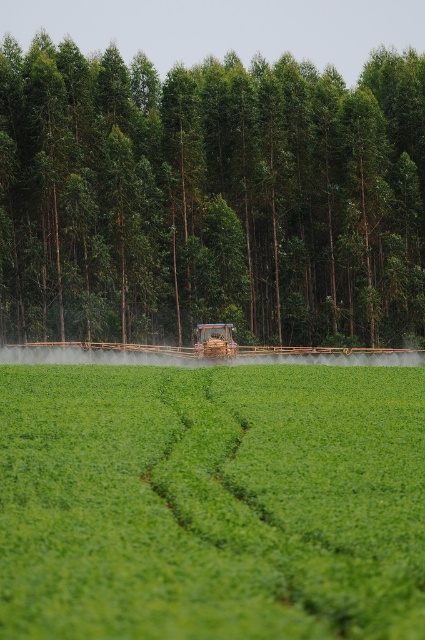
Who is shorter, green leafy tree at center or wooden brown tractor at center?

wooden brown tractor at center is shorter.

Can you confirm if green leafy tree at center is smaller than wooden brown tractor at center?

Incorrect, green leafy tree at center is not smaller in size than wooden brown tractor at center.

Who is more forward, (119, 134) or (198, 339)?

Point (198, 339) is in front.

Where is `green leafy tree at center`? The image size is (425, 640). green leafy tree at center is located at coordinates (209, 198).

Can you confirm if green leafy tree at center is positioned above green leafy field at center?

Yes, green leafy tree at center is above green leafy field at center.

How much distance is there between green leafy tree at center and green leafy field at center?

68.02 meters

Is point (272, 68) positioned after point (397, 394)?

Yes, point (272, 68) is behind point (397, 394).

Find the location of `green leafy tree at center`. green leafy tree at center is located at coordinates (209, 198).

Between green leafy field at center and wooden brown tractor at center, which one has less height?

green leafy field at center

Who is more distant from viewer, (416, 620) or (229, 336)?

Point (229, 336)

Is point (308, 417) less distant than point (212, 323)?

Yes.

Where is `green leafy field at center`? This screenshot has height=640, width=425. green leafy field at center is located at coordinates (212, 502).